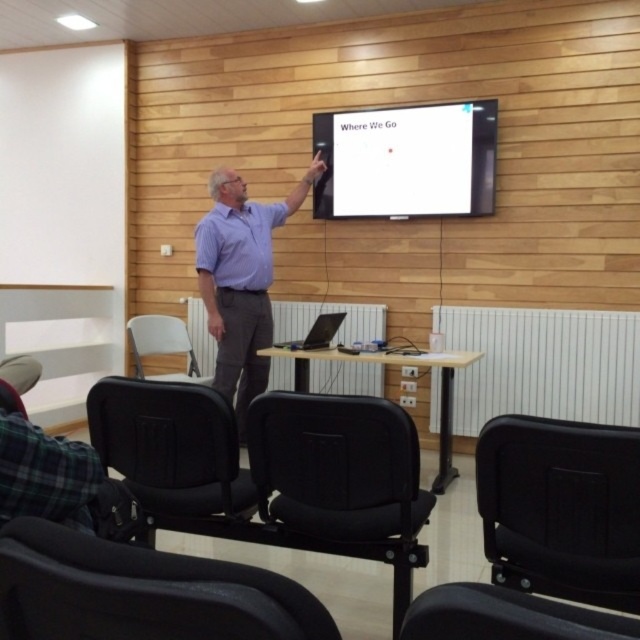
Question: Does black leather armchair at lower right lie behind satin black laptop at center?

Choices:
 (A) yes
 (B) no

Answer: (B)

Question: Estimate the real-world distances between objects in this image. Which object is farther from the black leather armchair at lower left?

Choices:
 (A) white plastic chair at lower left
 (B) black plastic chair at lower right

Answer: (A)

Question: Is black plastic chair at lower right to the right of matte purple shirt at center from the viewer's perspective?

Choices:
 (A) yes
 (B) no

Answer: (A)

Question: Is white glossy projection screen at upper center wider than black leather armchair at lower right?

Choices:
 (A) no
 (B) yes

Answer: (B)

Question: Which object is positioned farthest from the satin black laptop at center?

Choices:
 (A) white plastic chair at lower left
 (B) black plastic armchair at lower left
 (C) matte purple shirt at center
 (D) black leather armchair at lower left

Answer: (B)

Question: Which is farther from the black leather armchair at center?

Choices:
 (A) black leather armchair at lower right
 (B) black plastic armchair at lower left
 (C) white glossy projection screen at upper center

Answer: (C)